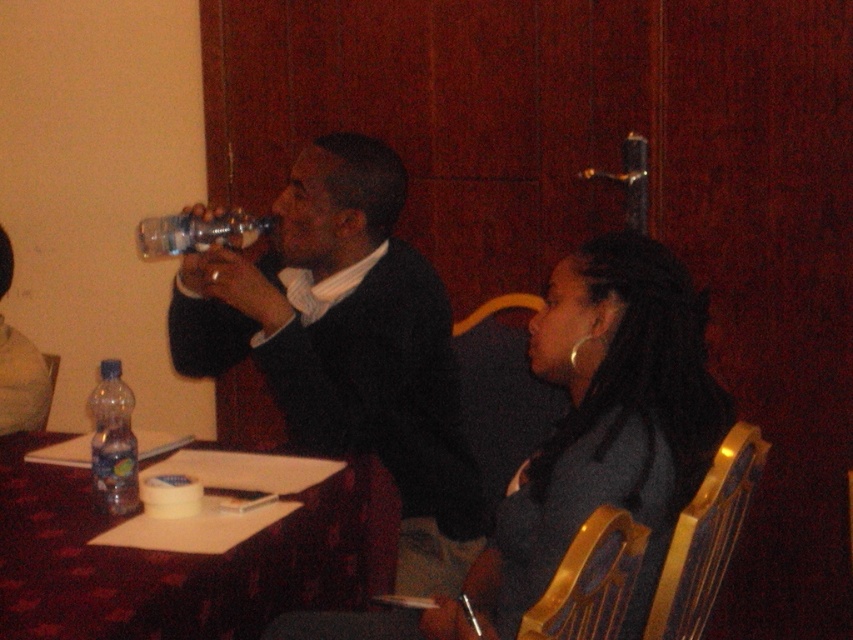
Is matte black sweater at center smaller than translucent plastic table at lower left?

No.

Who is higher up, matte black sweater at center or translucent plastic table at lower left?

matte black sweater at center is higher up.

Which is behind, point (373, 324) or point (199, 618)?

Point (373, 324)

Image resolution: width=853 pixels, height=640 pixels. In order to click on matte black sweater at center in this screenshot , I will do `click(341, 330)`.

Who is more distant from viewer, [384,433] or [497,620]?

The point [384,433] is more distant.

Is matte black sweater at center positioned at the back of matte black jacket at center?

Yes, it is.

Describe the element at coordinates (341, 330) in the screenshot. I see `matte black sweater at center` at that location.

Where is `matte black sweater at center`? This screenshot has height=640, width=853. matte black sweater at center is located at coordinates (341, 330).

Is point (285, 401) behind point (242, 218)?

No, (285, 401) is closer to viewer.

Who is taller, matte black sweater at center or clear plastic bottle at upper left?

With more height is matte black sweater at center.

Who is more forward, (331, 244) or (236, 230)?

Point (331, 244) is in front.

The height and width of the screenshot is (640, 853). Find the location of `matte black sweater at center`. matte black sweater at center is located at coordinates (341, 330).